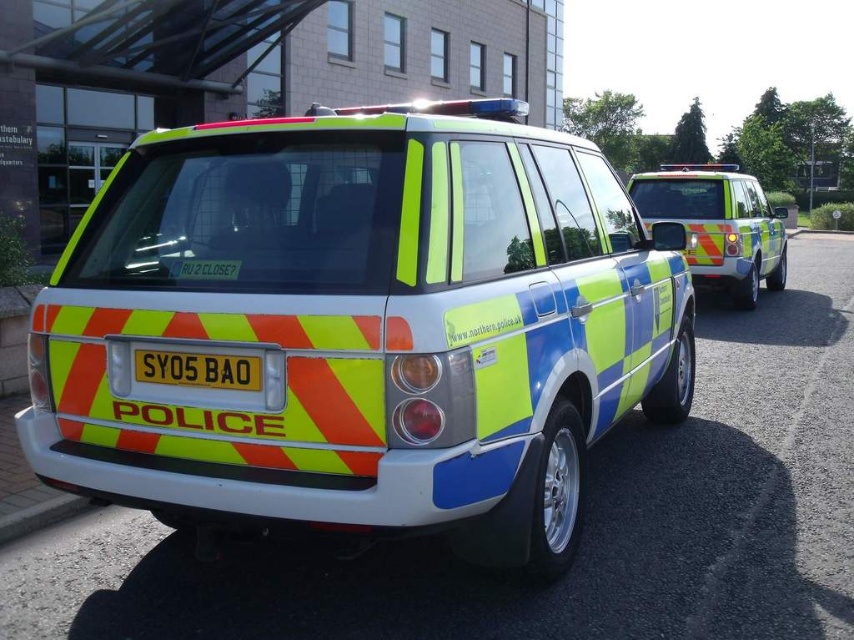
Question: Which of the following is the farthest from the observer?

Choices:
 (A) (636, 180)
 (B) (319, 154)

Answer: (A)

Question: Which point is farther to the camera?

Choices:
 (A) reflective plastic police car at center
 (B) reflective yellow-green suv at center-right

Answer: (B)

Question: Is reflective plastic police car at center closer to the viewer compared to reflective yellow-green suv at center-right?

Choices:
 (A) yes
 (B) no

Answer: (A)

Question: Which point appears farthest from the camera in this image?

Choices:
 (A) (550, 408)
 (B) (730, 300)

Answer: (B)

Question: Does reflective plastic police car at center have a greater width compared to reflective yellow-green suv at center-right?

Choices:
 (A) yes
 (B) no

Answer: (B)

Question: Considering the relative positions of reflective plastic police car at center and reflective yellow-green suv at center-right in the image provided, where is reflective plastic police car at center located with respect to reflective yellow-green suv at center-right?

Choices:
 (A) right
 (B) left

Answer: (B)